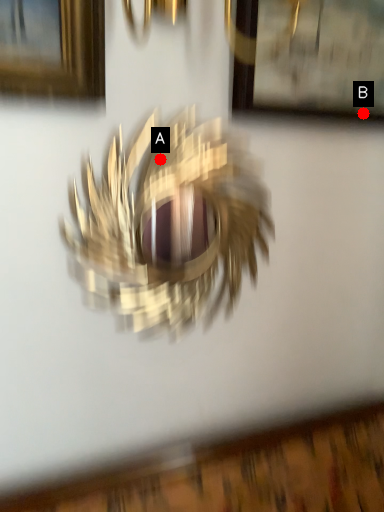
Question: Two points are circled on the image, labeled by A and B beside each circle. Among these points, which one is farthest from the camera?

Choices:
 (A) A is further
 (B) B is further

Answer: (B)